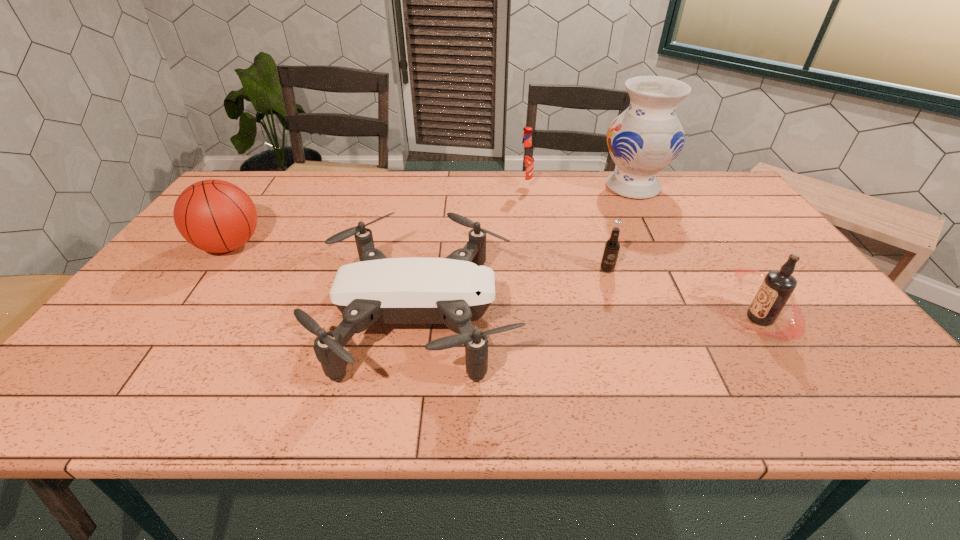
Where is `free space located 0.330m on the front of the leftmost object`? This screenshot has height=540, width=960. free space located 0.330m on the front of the leftmost object is located at coordinates (147, 363).

This screenshot has width=960, height=540. Find the location of `free space located 0.370m on the label of the nearest root beer`. free space located 0.370m on the label of the nearest root beer is located at coordinates (572, 318).

I want to click on vacant space situated 0.210m on the label of the nearest root beer, so click(637, 318).

In order to click on free space located on the label of the nearest root beer in this screenshot , I will do `click(666, 318)`.

Find the location of a particular element. This screenshot has height=540, width=960. free space located on the label of the second root beer from right to left is located at coordinates (622, 314).

I want to click on vacant area located on the camera side of the fifth object from right to left, so click(x=673, y=319).

Locate an element on the screen. vase at the far edge is located at coordinates (643, 140).

At what (x,y) coordinates should I click in order to perform the action: click on root beer at the far edge. Please return your answer as a coordinate pair (x, y). The width and height of the screenshot is (960, 540). Looking at the image, I should click on (525, 160).

Where is `object that is at the near edge`? The height and width of the screenshot is (540, 960). object that is at the near edge is located at coordinates (457, 290).

You are a GUI agent. You are given a task and a screenshot of the screen. Output one action in this format:
    pyautogui.click(x=<x>, y=<y>)
    Task: Click on the object at the left edge
    This screenshot has height=540, width=960.
    Given the screenshot: What is the action you would take?
    pyautogui.click(x=216, y=216)